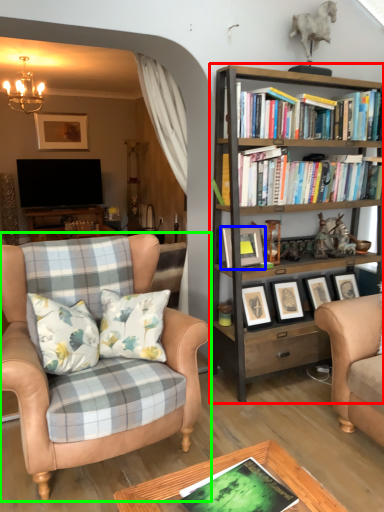
Question: Which object is the farthest from bookcase (highlighted by a red box)? Choose among these: picture frame (highlighted by a blue box) or chair (highlighted by a green box).

Choices:
 (A) picture frame
 (B) chair

Answer: (B)